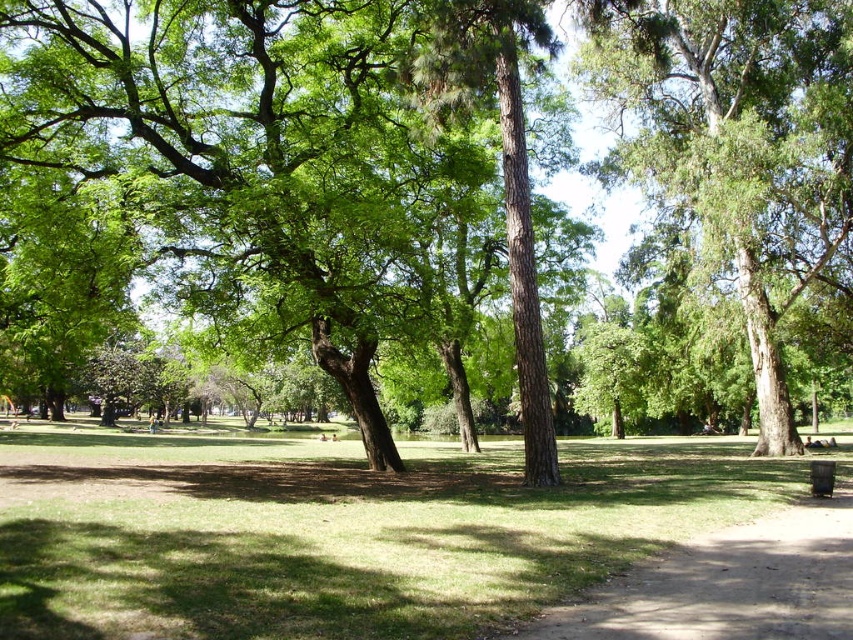
Question: Can you confirm if green grass at center is positioned below green leafy tree at center?

Choices:
 (A) yes
 (B) no

Answer: (A)

Question: Among these points, which one is farthest from the camera?

Choices:
 (A) (804, 552)
 (B) (749, 228)

Answer: (B)

Question: Is green grass at center further to camera compared to dirt path at lower right?

Choices:
 (A) no
 (B) yes

Answer: (A)

Question: Which object is farther from the camera taking this photo?

Choices:
 (A) green leafy tree at center
 (B) green grass at center
 (C) dirt path at lower right

Answer: (A)

Question: Does green grass at center appear under green leafy tree at center?

Choices:
 (A) yes
 (B) no

Answer: (A)

Question: Which object appears closest to the camera in this image?

Choices:
 (A) dirt path at lower right
 (B) green leafy tree at center

Answer: (A)